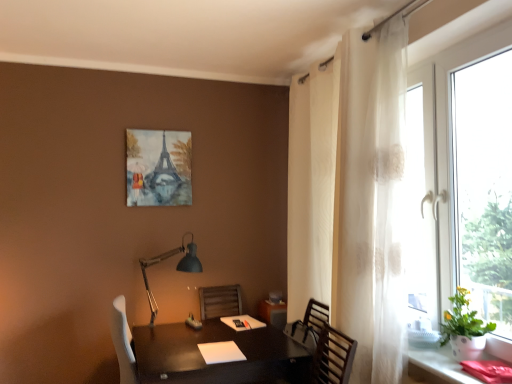
Question: Considering the positions of matte black lamp at lower left and white sheer curtain at right in the image, is matte black lamp at lower left bigger or smaller than white sheer curtain at right?

Choices:
 (A) big
 (B) small

Answer: (B)

Question: Considering the positions of matte black lamp at lower left and white sheer curtain at right in the image, is matte black lamp at lower left taller or shorter than white sheer curtain at right?

Choices:
 (A) tall
 (B) short

Answer: (B)

Question: Which of these objects is positioned closest to the matte black desk at lower right?

Choices:
 (A) green leafy plant at right
 (B) watercolor paper painting of eiffel tower at upper center
 (C) white sheer curtain at right
 (D) transparent glass window at right
 (E) shiny dark wood table at center

Answer: (A)

Question: Based on their relative distances, which object is nearer to the transparent glass window at right?

Choices:
 (A) white sheer curtain at right
 (B) matte black desk at lower right
 (C) matte black lamp at lower left
 (D) watercolor paper painting of eiffel tower at upper center
 (E) shiny dark wood table at center

Answer: (A)